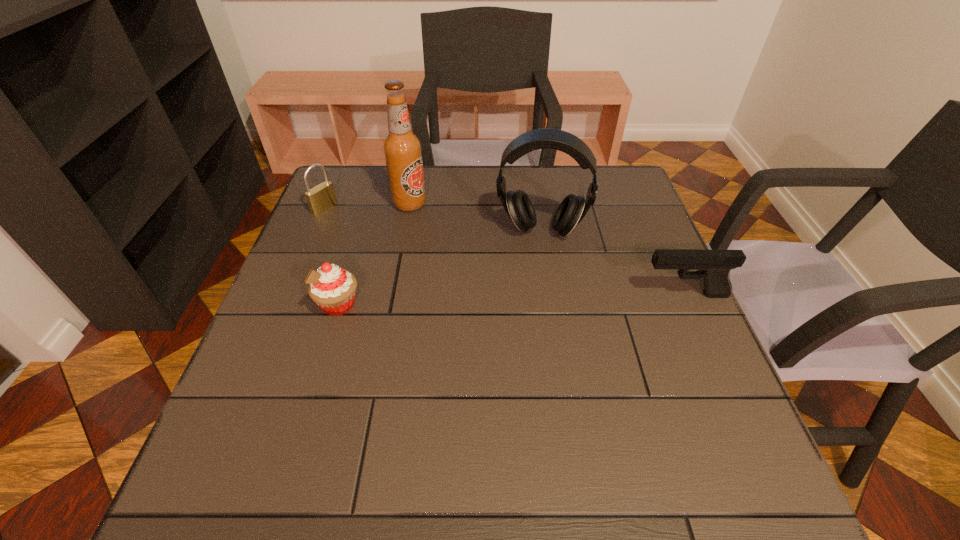
At what (x,y) coordinates should I click in order to perform the action: click on vacant region between the pistol and the earphone. Please return your answer as a coordinate pair (x, y). Image resolution: width=960 pixels, height=540 pixels. Looking at the image, I should click on (612, 262).

Locate an element on the screen. The height and width of the screenshot is (540, 960). free spot between the second object from left to right and the third object from right to left is located at coordinates (374, 254).

Find the location of a particular element. object identified as the third closest to the earphone is located at coordinates (331, 287).

Identify which object is located as the second nearest to the pistol. Please provide its 2D coordinates. Your answer should be formatted as a tuple, i.e. [(x, y)], where the tuple contains the x and y coordinates of a point satisfying the conditions above.

[(402, 148)]

The height and width of the screenshot is (540, 960). What are the coordinates of `free space that satisfies the following two spatial constraints: 1. on the front side of the leftmost object; 2. on the front-facing side of the pistol` in the screenshot? It's located at (289, 295).

In order to click on vacant space that satisfies the following two spatial constraints: 1. on the back side of the padlock; 2. on the right side of the beer bottle in this screenshot , I will do [x=326, y=204].